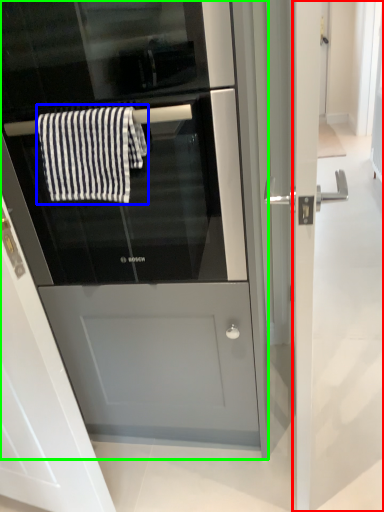
Question: Which object is the farthest from screen door (highlighted by a red box)? Choose among these: bath towel (highlighted by a blue box) or fridge (highlighted by a green box).

Choices:
 (A) bath towel
 (B) fridge

Answer: (A)